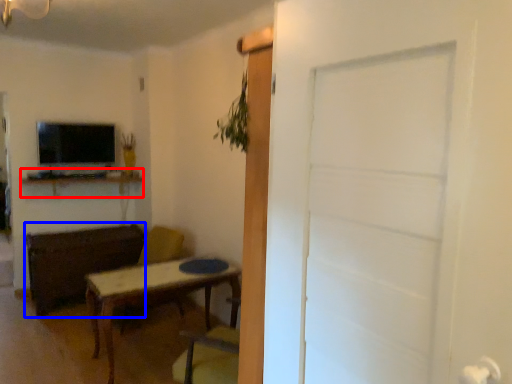
Question: Which object appears closest to the camera in this image, computer desk (highlighted by a red box) or brown (highlighted by a blue box)?

Choices:
 (A) computer desk
 (B) brown

Answer: (B)